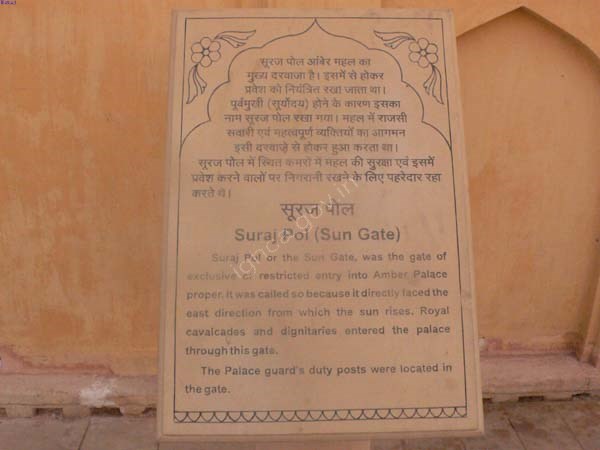
You are a GUI agent. You are given a task and a screenshot of the screen. Output one action in this format:
    pyautogui.click(x=<x>, y=<y>)
    Task: Click on the floral decoration
    
    Given the screenshot: What is the action you would take?
    pyautogui.click(x=209, y=53), pyautogui.click(x=424, y=50)